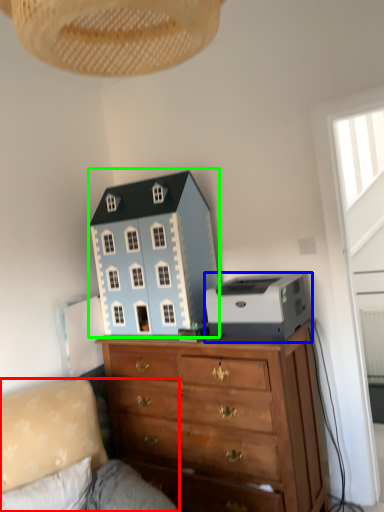
Question: Which object is positioned closest to studio couch (highlighted by a red box)? Select from printer (highlighted by a blue box) and toy (highlighted by a green box).

Choices:
 (A) printer
 (B) toy

Answer: (B)